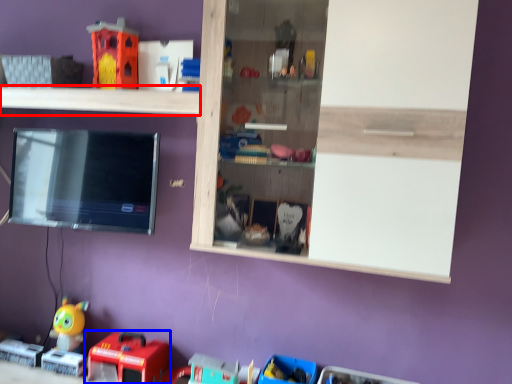
Question: Which object is further to the camera taking this photo, shelf (highlighted by a red box) or toy (highlighted by a blue box)?

Choices:
 (A) shelf
 (B) toy

Answer: (B)